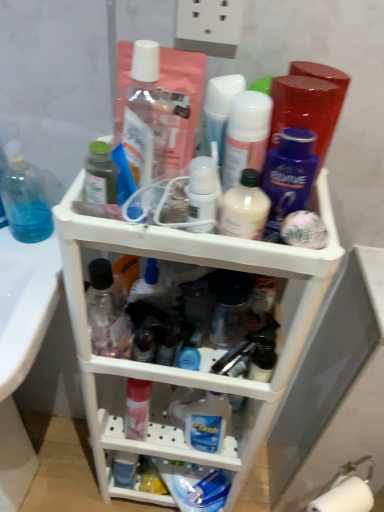
Identify the location of translucent plastic container at center, acting as the sixth toiletry starting from the right. Image resolution: width=384 pixels, height=512 pixels. [149, 286].

This screenshot has height=512, width=384. I want to click on milky white plastic bottle at center, which is counted as the second toiletry, starting from the right, so click(245, 208).

Describe the element at coordinates (202, 198) in the screenshot. This screenshot has width=384, height=512. I see `white glossy bottle at upper center, marked as the fifth toiletry in a right-to-left arrangement` at that location.

Measure the distance between matte white lotion at center, the sixth toiletry in the left-to-right sequence, and camera.

19.84 inches.

The height and width of the screenshot is (512, 384). I want to click on transparent plastic bottle at center, acting as the first toiletry starting from the left, so click(x=108, y=312).

Locate an element on the screen. The image size is (384, 512). white plastic shelf at center is located at coordinates coord(173,367).

Identify the location of purple glossy deodorant at upper center, arranged as the first toiletry when viewed from the right. The image size is (384, 512). (288, 177).

This screenshot has height=512, width=384. In order to click on translucent plastic container at center, the third toiletry viewed from the left in this screenshot , I will do `click(149, 286)`.

Find the location of a particular element. bottle directly beneath the green matte bottle at upper left, the seventh toiletry when ordered from right to left (from a real-world perspective) is located at coordinates (25, 198).

Does green matte bottle at upper left, the seventh toiletry when ordered from right to left, lie in front of transparent plastic hand soap at left?

Yes, the depth of green matte bottle at upper left, the seventh toiletry when ordered from right to left, is less than that of transparent plastic hand soap at left.

Considering the relative positions of green matte bottle at upper left, the seventh toiletry when ordered from right to left, and transparent plastic hand soap at left in the image provided, is green matte bottle at upper left, the seventh toiletry when ordered from right to left, to the right of transparent plastic hand soap at left from the viewer's perspective?

Yes.

Is green matte bottle at upper left, the seventh toiletry when ordered from right to left, next to transparent plastic hand soap at left and touching it?

No.

Find the location of a particular element. toiletry that is the 3rd one when counting leftward from the milky white plastic bottle at center, which is counted as the second toiletry, starting from the right is located at coordinates point(202,198).

Between white glossy bottle at upper center, which appears as the fourth toiletry when viewed from the left, and milky white plastic bottle at center, which is counted as the second toiletry, starting from the right, which one has smaller width?

white glossy bottle at upper center, which appears as the fourth toiletry when viewed from the left, is thinner.

From the image's perspective, is white glossy bottle at upper center, marked as the fifth toiletry in a right-to-left arrangement, located above milky white plastic bottle at center, which ranks as the 7th toiletry in left-to-right order?

Correct, white glossy bottle at upper center, marked as the fifth toiletry in a right-to-left arrangement, appears higher than milky white plastic bottle at center, which ranks as the 7th toiletry in left-to-right order, in the image.

Which of these two, white glossy bottle at upper center, which appears as the fourth toiletry when viewed from the left, or milky white plastic bottle at center, which ranks as the 7th toiletry in left-to-right order, stands taller?

milky white plastic bottle at center, which ranks as the 7th toiletry in left-to-right order, is taller.

Does translucent plastic container at center, acting as the sixth toiletry starting from the right, have a greater width compared to matte white lotion at center, marked as the fifth toiletry in a left-to-right arrangement?

Yes, translucent plastic container at center, acting as the sixth toiletry starting from the right, is wider than matte white lotion at center, marked as the fifth toiletry in a left-to-right arrangement.

Who is bigger, translucent plastic container at center, acting as the sixth toiletry starting from the right, or matte white lotion at center, marked as the 4th toiletry in a right-to-left arrangement?

translucent plastic container at center, acting as the sixth toiletry starting from the right.

Where is `toiletry that is the 7th object above the translucent plastic container at center, the third toiletry viewed from the left (from a real-world perspective)`? This screenshot has height=512, width=384. toiletry that is the 7th object above the translucent plastic container at center, the third toiletry viewed from the left (from a real-world perspective) is located at coordinates (220, 109).

Can you tell me how much translucent plastic container at center, acting as the sixth toiletry starting from the right, and matte white lotion at center, marked as the 4th toiletry in a right-to-left arrangement, differ in facing direction?

They differ by 7.11 degrees in their facing directions.

From the picture: Considering the sizes of purple glossy deodorant at upper center, which is the eighth toiletry in left-to-right order, and translucent plastic container at center, acting as the sixth toiletry starting from the right, in the image, is purple glossy deodorant at upper center, which is the eighth toiletry in left-to-right order, taller or shorter than translucent plastic container at center, acting as the sixth toiletry starting from the right,?

purple glossy deodorant at upper center, which is the eighth toiletry in left-to-right order, is taller than translucent plastic container at center, acting as the sixth toiletry starting from the right.

Locate an element on the screen. Image resolution: width=384 pixels, height=512 pixels. the 6th toiletry in front of the translucent plastic container at center, acting as the sixth toiletry starting from the right is located at coordinates (288, 177).

Relative to translucent plastic container at center, the third toiletry viewed from the left, is purple glossy deodorant at upper center, arranged as the first toiletry when viewed from the right, in front or behind?

Clearly, purple glossy deodorant at upper center, arranged as the first toiletry when viewed from the right, is in front of translucent plastic container at center, the third toiletry viewed from the left.

Is purple glossy deodorant at upper center, which is the eighth toiletry in left-to-right order, thinner than translucent plastic container at center, acting as the sixth toiletry starting from the right?

Yes, purple glossy deodorant at upper center, which is the eighth toiletry in left-to-right order, is thinner than translucent plastic container at center, acting as the sixth toiletry starting from the right.

Looking at this image, looking at the image, does translucent plastic container at center, the third toiletry viewed from the left, seem bigger or smaller compared to purple glossy deodorant at upper center, arranged as the first toiletry when viewed from the right?

Clearly, translucent plastic container at center, the third toiletry viewed from the left, is larger in size than purple glossy deodorant at upper center, arranged as the first toiletry when viewed from the right.

From the image's perspective, would you say translucent plastic container at center, the third toiletry viewed from the left, is positioned over purple glossy deodorant at upper center, which is the eighth toiletry in left-to-right order?

Incorrect, from the image's perspective, translucent plastic container at center, the third toiletry viewed from the left, is lower than purple glossy deodorant at upper center, which is the eighth toiletry in left-to-right order.

Which object is closer to the camera, translucent plastic container at center, the third toiletry viewed from the left, or purple glossy deodorant at upper center, which is the eighth toiletry in left-to-right order?

purple glossy deodorant at upper center, which is the eighth toiletry in left-to-right order, is more forward.

Is green matte bottle at upper left, the seventh toiletry when ordered from right to left, a part of purple glossy deodorant at upper center, arranged as the first toiletry when viewed from the right?

No.

Is purple glossy deodorant at upper center, arranged as the first toiletry when viewed from the right, far from green matte bottle at upper left, the seventh toiletry when ordered from right to left?

They are positioned close to each other.

Identify the location of the 3rd toiletry above the green matte bottle at upper left, the seventh toiletry when ordered from right to left (from a real-world perspective). This screenshot has width=384, height=512. (288, 177).

Considering the sizes of objects purple glossy deodorant at upper center, which is the eighth toiletry in left-to-right order, and green matte bottle at upper left, the seventh toiletry when ordered from right to left, in the image provided, who is wider, purple glossy deodorant at upper center, which is the eighth toiletry in left-to-right order, or green matte bottle at upper left, the seventh toiletry when ordered from right to left,?

green matte bottle at upper left, the seventh toiletry when ordered from right to left, is wider.

What are the coordinates of `the 3rd toiletry above the transparent plastic bottle at center, which is the 8th toiletry in right-to-left order (from a real-world perspective)` in the screenshot? It's located at (202, 198).

From a real-world perspective, who is located lower, white glossy bottle at upper center, which appears as the fourth toiletry when viewed from the left, or transparent plastic bottle at center, which is the 8th toiletry in right-to-left order?

transparent plastic bottle at center, which is the 8th toiletry in right-to-left order.

Can you confirm if white glossy bottle at upper center, which appears as the fourth toiletry when viewed from the left, is positioned to the left of transparent plastic bottle at center, acting as the first toiletry starting from the left?

Incorrect, white glossy bottle at upper center, which appears as the fourth toiletry when viewed from the left, is not on the left side of transparent plastic bottle at center, acting as the first toiletry starting from the left.

From the image's perspective, is white glossy bottle at upper center, marked as the fifth toiletry in a right-to-left arrangement, beneath transparent plastic bottle at center, acting as the first toiletry starting from the left?

Actually, white glossy bottle at upper center, marked as the fifth toiletry in a right-to-left arrangement, appears above transparent plastic bottle at center, acting as the first toiletry starting from the left, in the image.

Which toiletry is the 2nd one when counting from the front of the transparent plastic hand soap at left? Please provide its 2D coordinates.

[(100, 175)]

Locate an element on the screen. This screenshot has width=384, height=512. the 1st toiletry below the white glossy bottle at upper center, marked as the fifth toiletry in a right-to-left arrangement (from a real-world perspective) is located at coordinates (245, 208).

Considering their positions, is purple glossy deodorant at upper center, which is the eighth toiletry in left-to-right order, positioned closer to matte white lotion at center, marked as the fifth toiletry in a left-to-right arrangement, than milky white plastic bottle at center, which is counted as the second toiletry, starting from the right?

milky white plastic bottle at center, which is counted as the second toiletry, starting from the right, is closer to matte white lotion at center, marked as the fifth toiletry in a left-to-right arrangement.

Considering their positions, is matte white lotion at center, marked as the 4th toiletry in a right-to-left arrangement, positioned closer to white glossy bottle at upper center, which appears as the fourth toiletry when viewed from the left, than translucent plastic container at center, the third toiletry viewed from the left?

The object closer to white glossy bottle at upper center, which appears as the fourth toiletry when viewed from the left, is matte white lotion at center, marked as the 4th toiletry in a right-to-left arrangement.

Estimate the real-world distances between objects in this image. Which object is further from translucent plastic container at center, acting as the sixth toiletry starting from the right, matte white lotion at center, the third toiletry when ordered from right to left, or white plastic shelf at center?

Based on the image, matte white lotion at center, the third toiletry when ordered from right to left, appears to be further to translucent plastic container at center, acting as the sixth toiletry starting from the right.

When comparing their distances from milky white plastic bottle at center, which is counted as the second toiletry, starting from the right, does matte white lotion at center, marked as the 4th toiletry in a right-to-left arrangement, or transparent plastic hand soap at left seem further?

transparent plastic hand soap at left lies further to milky white plastic bottle at center, which is counted as the second toiletry, starting from the right, than the other object.

Consider the image. Looking at the image, which one is located closer to translucent plastic container at center, acting as the sixth toiletry starting from the right, matte white lotion at center, the third toiletry when ordered from right to left, or green matte bottle at upper left, which is the second toiletry in left-to-right order?

green matte bottle at upper left, which is the second toiletry in left-to-right order, is positioned closer to the anchor translucent plastic container at center, acting as the sixth toiletry starting from the right.

Which object lies further to the anchor point white plastic shelf at center, milky white plastic bottle at center, which ranks as the 7th toiletry in left-to-right order, or transparent plastic hand soap at left?

Based on the image, milky white plastic bottle at center, which ranks as the 7th toiletry in left-to-right order, appears to be further to white plastic shelf at center.

Estimate the real-world distances between objects in this image. Which object is closer to green matte bottle at upper left, the seventh toiletry when ordered from right to left, white glossy bottle at upper center, which appears as the fourth toiletry when viewed from the left, or translucent plastic container at center, acting as the sixth toiletry starting from the right?

Based on the image, white glossy bottle at upper center, which appears as the fourth toiletry when viewed from the left, appears to be nearer to green matte bottle at upper left, the seventh toiletry when ordered from right to left.

Which object lies nearer to the anchor point white glossy bottle at upper center, marked as the fifth toiletry in a right-to-left arrangement, translucent plastic container at center, the third toiletry viewed from the left, or white plastic shelf at center?

Among the two, translucent plastic container at center, the third toiletry viewed from the left, is located nearer to white glossy bottle at upper center, marked as the fifth toiletry in a right-to-left arrangement.

You are a GUI agent. You are given a task and a screenshot of the screen. Output one action in this format:
    pyautogui.click(x=<x>, y=<y>)
    Task: Click on the bottle between green matte bottle at upper left, the seventh toiletry when ordered from right to left, and white plastic shelf at center, in the vertical direction
    This screenshot has width=384, height=512.
    Given the screenshot: What is the action you would take?
    pyautogui.click(x=25, y=198)

Identify the location of bottle between green matte bottle at upper left, which is the second toiletry in left-to-right order, and transparent plastic bottle at center, acting as the first toiletry starting from the left, in the up-down direction. The width and height of the screenshot is (384, 512). (25, 198).

Locate an element on the screen. bottle between matte white lotion at center, marked as the fifth toiletry in a left-to-right arrangement, and white plastic shelf at center in the up-down direction is located at coordinates (25, 198).

Where is `bottle that lies between matte white lotion at center, the sixth toiletry in the left-to-right sequence, and white plastic shelf at center from top to bottom`? This screenshot has width=384, height=512. bottle that lies between matte white lotion at center, the sixth toiletry in the left-to-right sequence, and white plastic shelf at center from top to bottom is located at coordinates (25, 198).